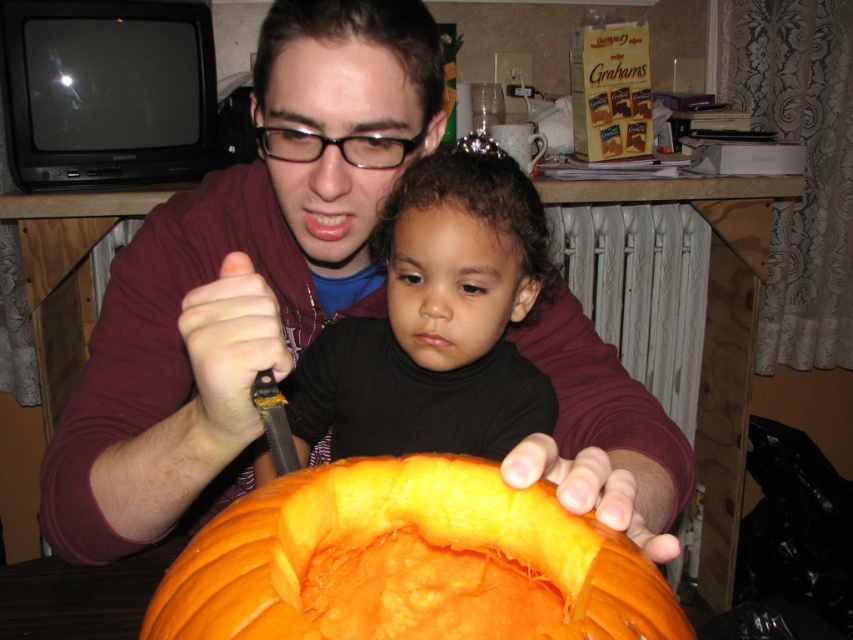
Question: Which object appears farthest from the camera in this image?

Choices:
 (A) black matte baby at center
 (B) orange smooth pumpkin at center

Answer: (A)

Question: Which point is closer to the camera?

Choices:
 (A) (614, 468)
 (B) (439, 467)
 (C) (494, 403)

Answer: (B)

Question: Does orange smooth pumpkin at center appear under black matte baby at center?

Choices:
 (A) no
 (B) yes

Answer: (B)

Question: Which point is farther to the camera?

Choices:
 (A) matte maroon hoodie at center
 (B) orange smooth pumpkin at center
 (C) black matte baby at center

Answer: (C)

Question: Can you confirm if matte maroon hoodie at center is wider than black matte baby at center?

Choices:
 (A) yes
 (B) no

Answer: (A)

Question: Does matte maroon hoodie at center appear under orange smooth pumpkin at center?

Choices:
 (A) no
 (B) yes

Answer: (A)